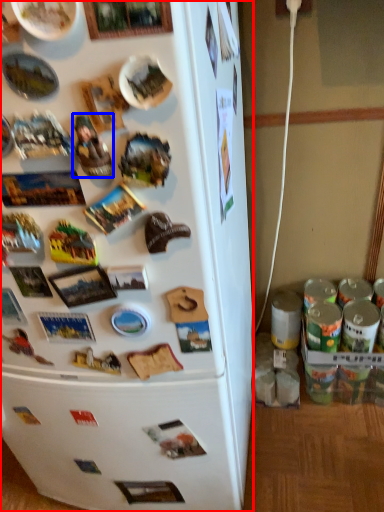
Question: Which object appears closest to the camera in this image, refrigerator (highlighted by a red box) or toy (highlighted by a blue box)?

Choices:
 (A) refrigerator
 (B) toy

Answer: (A)